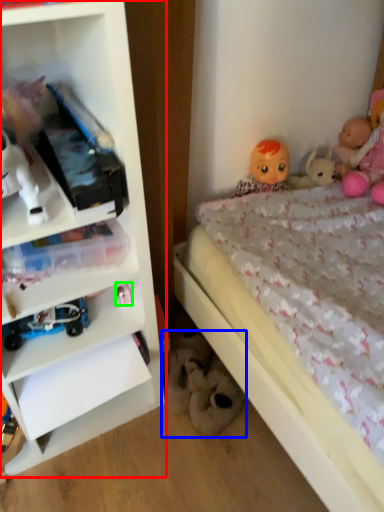
Question: Estimate the real-world distances between objects in this image. Which object is closer to shelf (highlighted by a red box), toy (highlighted by a blue box) or toy (highlighted by a green box)?

Choices:
 (A) toy
 (B) toy

Answer: (B)